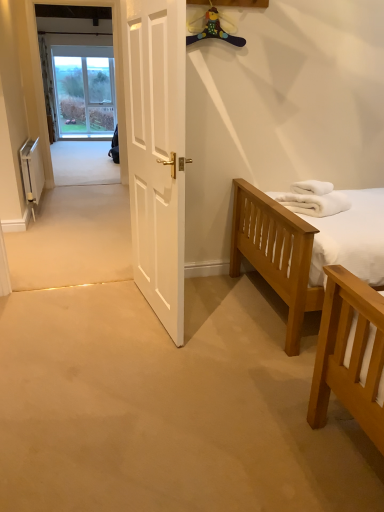
Question: Are white matte door at center and white metallic radiator at left far apart?

Choices:
 (A) yes
 (B) no

Answer: (A)

Question: Can you confirm if white matte door at center is wider than white metallic radiator at left?

Choices:
 (A) no
 (B) yes

Answer: (A)

Question: Considering the relative sizes of white matte door at center and white metallic radiator at left in the image provided, is white matte door at center smaller than white metallic radiator at left?

Choices:
 (A) yes
 (B) no

Answer: (B)

Question: From a real-world perspective, is white matte door at center on top of white metallic radiator at left?

Choices:
 (A) no
 (B) yes

Answer: (B)

Question: Is white matte door at center thinner than white metallic radiator at left?

Choices:
 (A) no
 (B) yes

Answer: (B)

Question: Is white metallic radiator at left taller or shorter than white fluffy towels at right?

Choices:
 (A) short
 (B) tall

Answer: (B)

Question: Is point (41, 172) closer or farther from the camera than point (294, 187)?

Choices:
 (A) farther
 (B) closer

Answer: (A)

Question: In the image, is white metallic radiator at left on the left side or the right side of white fluffy towels at right?

Choices:
 (A) right
 (B) left

Answer: (B)

Question: Based on their sizes in the image, would you say white metallic radiator at left is bigger or smaller than white fluffy towels at right?

Choices:
 (A) small
 (B) big

Answer: (B)

Question: From a real-world perspective, is white matte door at center physically located above or below white fluffy towels at right?

Choices:
 (A) below
 (B) above

Answer: (B)

Question: Considering the positions of white matte door at center and white fluffy towels at right in the image, is white matte door at center wider or thinner than white fluffy towels at right?

Choices:
 (A) thin
 (B) wide

Answer: (A)

Question: Considering the relative positions of white matte door at center and white fluffy towels at right in the image provided, is white matte door at center to the left or to the right of white fluffy towels at right?

Choices:
 (A) right
 (B) left

Answer: (B)

Question: Is point (152, 169) positioned closer to the camera than point (331, 189)?

Choices:
 (A) closer
 (B) farther

Answer: (A)

Question: From a real-world perspective, relative to white matte door at center, is white metallic radiator at left vertically above or below?

Choices:
 (A) below
 (B) above

Answer: (A)

Question: Based on their positions, is white metallic radiator at left located to the left or right of white matte door at center?

Choices:
 (A) left
 (B) right

Answer: (A)